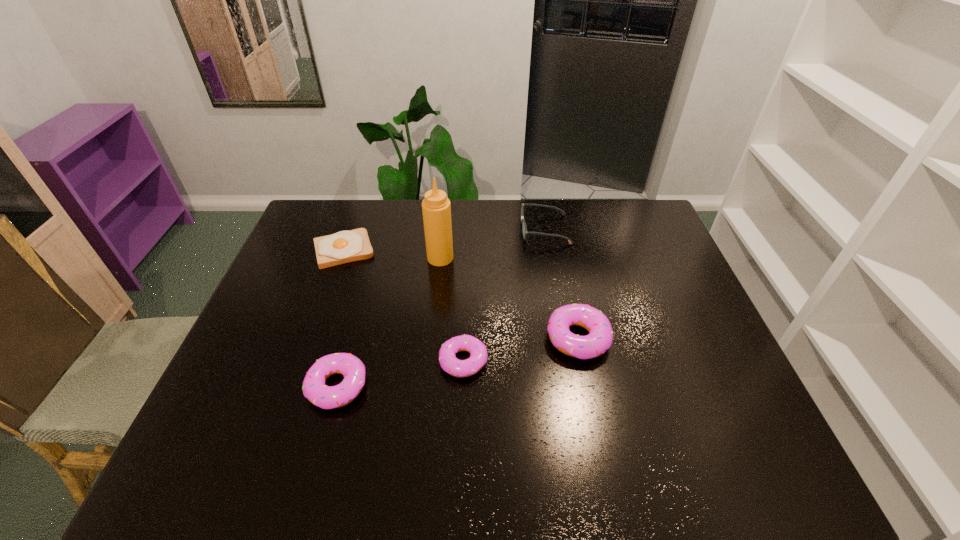
This screenshot has height=540, width=960. Identify the location of the second shortest doughnut. (352, 368).

Where is `the shortest doughnut`? the shortest doughnut is located at coordinates (478, 357).

You are a GUI agent. You are given a task and a screenshot of the screen. Output one action in this format:
    pyautogui.click(x=<x>, y=<y>)
    Task: Click on the rightmost doughnut
    
    Given the screenshot: What is the action you would take?
    pyautogui.click(x=599, y=339)

Where is `spectacles`? The height and width of the screenshot is (540, 960). spectacles is located at coordinates 524,228.

I want to click on the shortest object, so click(x=346, y=246).

Identify the location of the tallest object. (436, 208).

Image resolution: width=960 pixels, height=540 pixels. I want to click on free space located 0.200m on the left of the leftmost doughnut, so pos(225,386).

Where is `vacant position located on the right of the second doughnut from right to left`? The width and height of the screenshot is (960, 540). vacant position located on the right of the second doughnut from right to left is located at coordinates (527, 361).

This screenshot has width=960, height=540. What are the coordinates of `vacant space located 0.330m on the back of the rightmost doughnut` in the screenshot? It's located at (558, 241).

This screenshot has width=960, height=540. In order to click on vacant space located 0.320m on the face of the spectacles in this screenshot , I will do `click(428, 230)`.